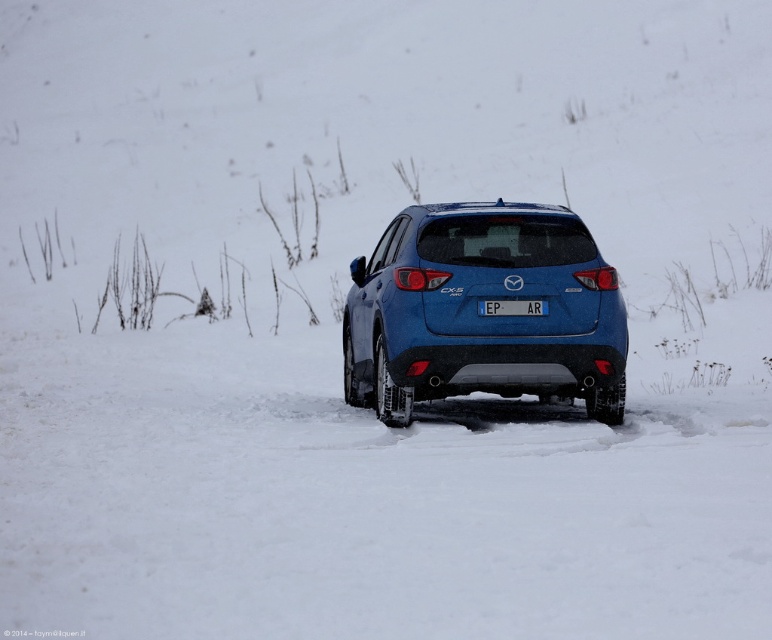
You are a delivery driver who needs to confirm the license plate number of the blue matte suv at center. Since the white plastic license plate at center is partially obscured by snow, can you still read the license plate number?

The blue matte suv at center is closer to the viewer than the white plastic license plate at center, so the license plate is farther away and may be harder to read due to its distance and snow obstruction.

You are standing in front of a blue Mazda CX5 parked on a snowy landscape. You see two points marked on the car. The first point is at coordinate point (x=593, y=353) and the second point is at coordinate point (x=486, y=314). Which point is closer to you?

Point (x=593, y=353) is further to the viewer than point (x=486, y=314), so the second point at (x=486, y=314) is closer to you.

You are a delivery driver who needs to park your truck next to the blue matte suv at center. The parking space is only 1.5 meters wide. Can you fit your truck if the white plastic license plate at center is 0.3 meters wide?

The blue matte suv at center is wider than the white plastic license plate at center. Since the license plate is 0.3 meters wide, the suv is wider than 0.3 meters. However, the parking space is 1.5 meters wide, which is likely sufficient for the truck, as the suv itself is wider than the license plate but the exact width of the suv isn